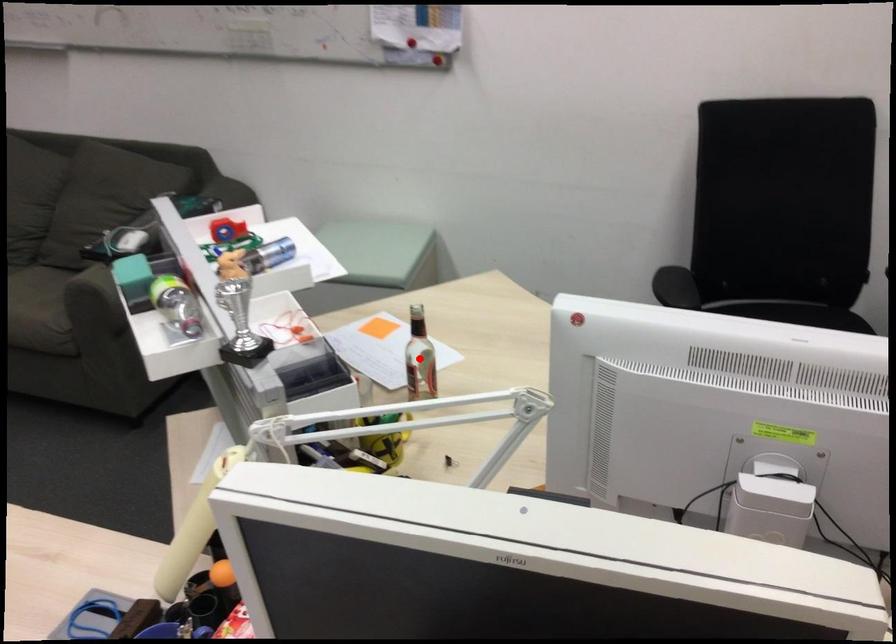
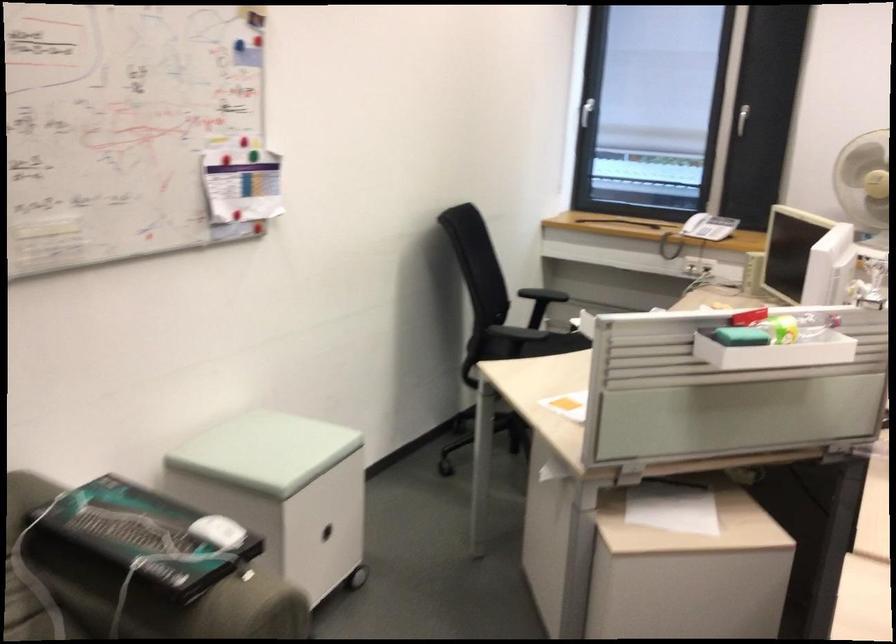
Question: I am providing you with two images of the same scene from different viewpoints. A red point is marked on the first image. Is the red point's position out of view in image 2?

Choices:
 (A) Yes
 (B) No

Answer: (A)